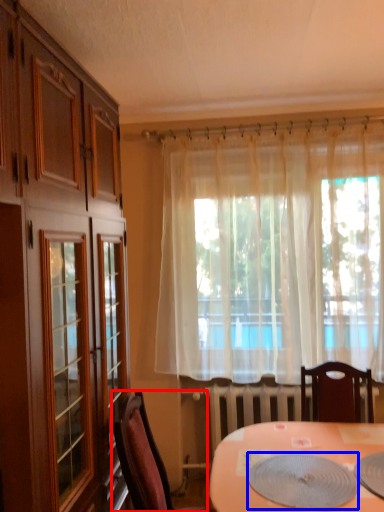
Question: Which object is closer to the camera taking this photo, chair (highlighted by a red box) or platter (highlighted by a blue box)?

Choices:
 (A) chair
 (B) platter

Answer: (B)